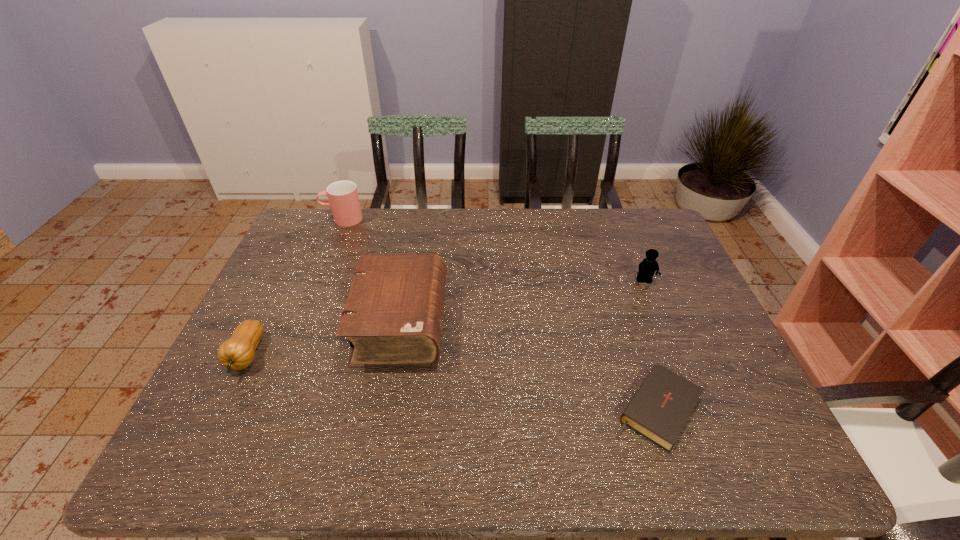
Where is `cup`? The width and height of the screenshot is (960, 540). cup is located at coordinates (344, 203).

Identify the location of the left Bible. (393, 316).

In order to click on the third object from right to left in this screenshot , I will do `click(393, 316)`.

Where is `Lego`? Image resolution: width=960 pixels, height=540 pixels. Lego is located at coordinates (647, 268).

Locate an element on the screen. The width and height of the screenshot is (960, 540). the second shortest object is located at coordinates 238,352.

The width and height of the screenshot is (960, 540). Identify the location of the shortest object. (659, 410).

Identify the location of the shorter Bible. (659, 410).

I want to click on vacant space positioned on the spine side of the left Bible, so click(491, 323).

You are a GUI agent. You are given a task and a screenshot of the screen. Output one action in this format:
    pyautogui.click(x=<x>, y=<y>)
    Task: Click on the vacant space located 0.370m on the front-facing side of the Lego
    
    Given the screenshot: What is the action you would take?
    pyautogui.click(x=691, y=396)

Locate an element on the screen. The width and height of the screenshot is (960, 540). vacant space located on the stem side of the gourd is located at coordinates (217, 417).